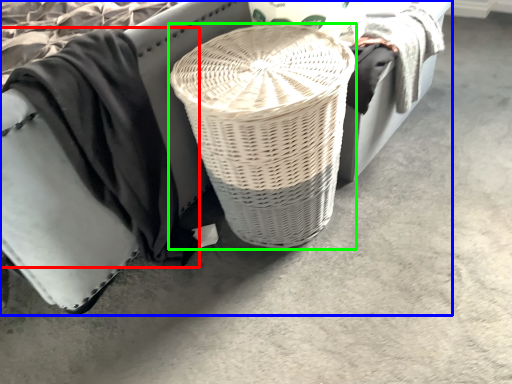
Question: Considering the real-world distances, which object is closest to clothing (highlighted by a red box)? furniture (highlighted by a blue box) or basket (highlighted by a green box).

Choices:
 (A) furniture
 (B) basket

Answer: (A)